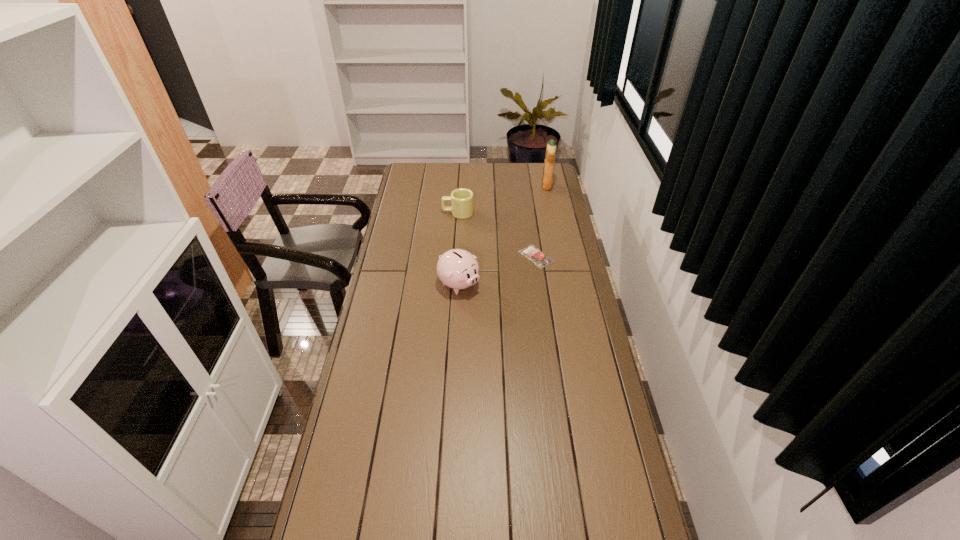
This screenshot has width=960, height=540. I want to click on object that ranks as the closest to the third shortest object, so click(540, 259).

Find the location of a particular element. The image size is (960, 540). object that is the closest one to the third nearest object is located at coordinates (540, 259).

Where is `free region that satisfies the following two spatial constraints: 1. with the handle on the side of the third nearest object; 2. on the back side of the nearest object`? The width and height of the screenshot is (960, 540). free region that satisfies the following two spatial constraints: 1. with the handle on the side of the third nearest object; 2. on the back side of the nearest object is located at coordinates (453, 284).

Where is `vacant area that satisfies the following two spatial constraints: 1. with the handle on the side of the mug; 2. on the back side of the third object from left to right`? The width and height of the screenshot is (960, 540). vacant area that satisfies the following two spatial constraints: 1. with the handle on the side of the mug; 2. on the back side of the third object from left to right is located at coordinates (455, 256).

Locate an element on the screen. vacant point that satisfies the following two spatial constraints: 1. with the handle on the side of the mug; 2. on the back side of the second tallest object is located at coordinates (453, 284).

This screenshot has height=540, width=960. Find the location of `free spot that satisfies the following two spatial constraints: 1. with the handle on the side of the third nearest object; 2. on the back side of the steak`. free spot that satisfies the following two spatial constraints: 1. with the handle on the side of the third nearest object; 2. on the back side of the steak is located at coordinates (455, 256).